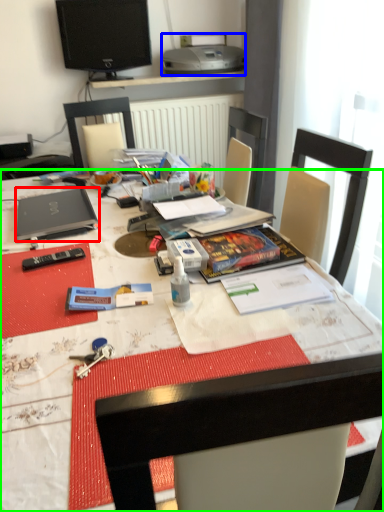
Question: Which object is the farthest from laptop (highlighted by a red box)? Choose among these: printer (highlighted by a blue box) or desk (highlighted by a green box).

Choices:
 (A) printer
 (B) desk

Answer: (A)